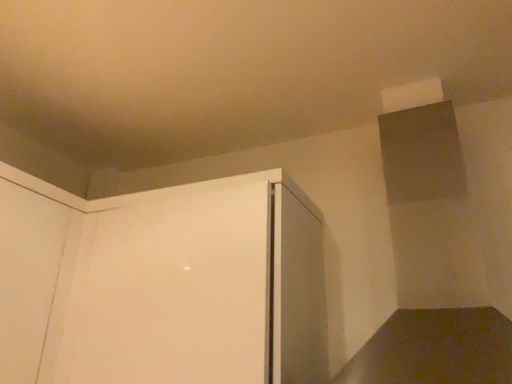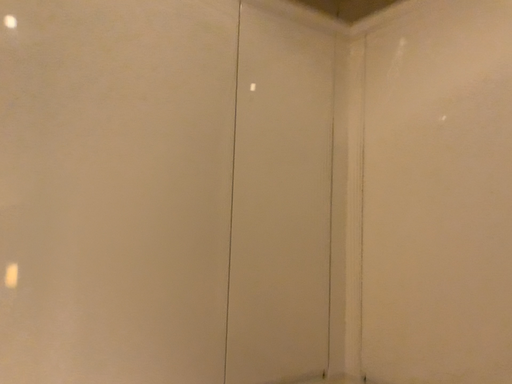
Question: How did the camera likely rotate when shooting the video?

Choices:
 (A) rotated downward
 (B) rotated upward

Answer: (A)